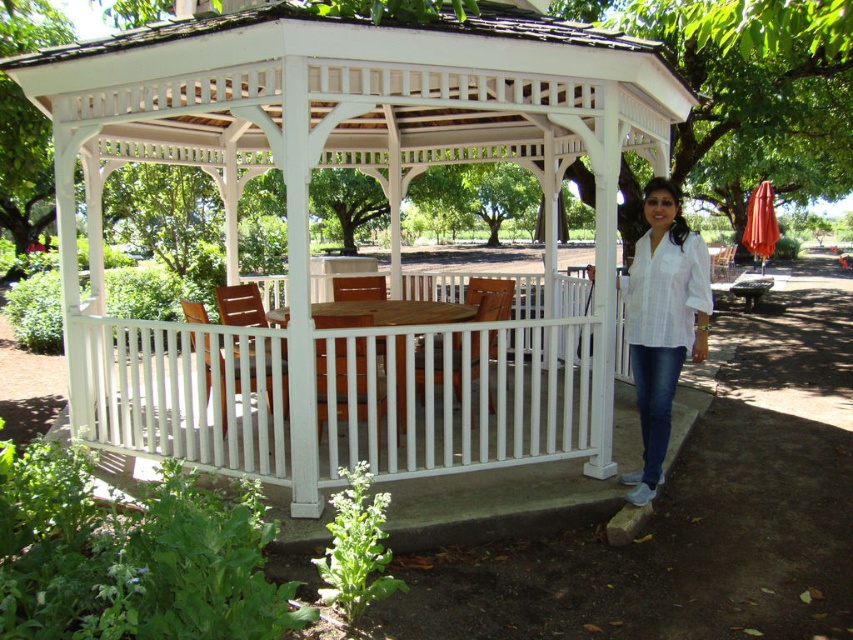
Question: Can you confirm if white painted wood porch at center is positioned to the left of wooden picnic table at center?

Choices:
 (A) yes
 (B) no

Answer: (B)

Question: Among these objects, which one is nearest to the camera?

Choices:
 (A) wooden picnic table at center
 (B) white wood gazebo at center
 (C) white painted wood porch at center
 (D) white cotton shirt at lower right

Answer: (C)

Question: Is white wood gazebo at center above wooden picnic table at center?

Choices:
 (A) no
 (B) yes

Answer: (A)

Question: Which object is closer to the camera taking this photo?

Choices:
 (A) white wood gazebo at center
 (B) white cotton shirt at lower right
 (C) wooden picnic table at center

Answer: (A)

Question: Can you confirm if white painted wood porch at center is positioned to the left of wooden picnic table at center?

Choices:
 (A) no
 (B) yes

Answer: (A)

Question: Which object appears closest to the camera in this image?

Choices:
 (A) white wood gazebo at center
 (B) wooden picnic table at center
 (C) white painted wood porch at center
 (D) white cotton shirt at lower right

Answer: (C)